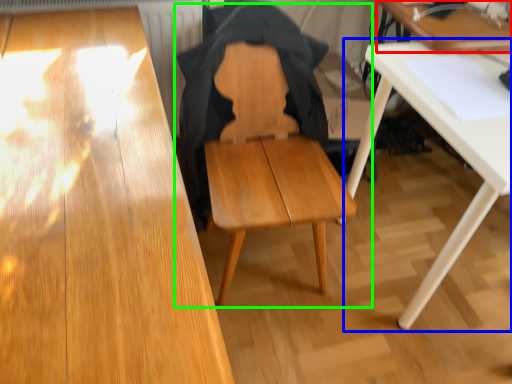
Question: Based on their relative distances, which object is farther from table (highlighted by a red box)? Choose from table (highlighted by a blue box) and chair (highlighted by a green box).

Choices:
 (A) table
 (B) chair

Answer: (B)